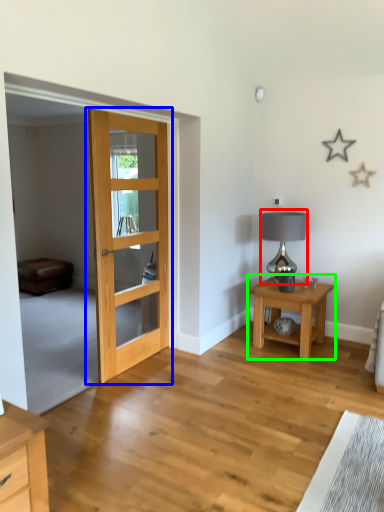
Question: Which object is positioned closest to table lamp (highlighted by a red box)? Select from door (highlighted by a blue box) and nightstand (highlighted by a green box).

Choices:
 (A) door
 (B) nightstand

Answer: (B)